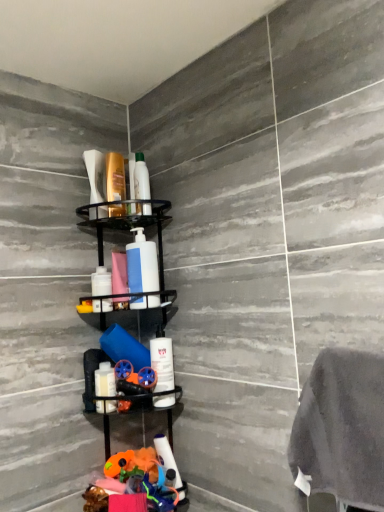
Measure the distance between translucent plastic shampoo bottle at upper center, which is the 5th toiletry in bottom-to-top order, and camera.

4.08 feet.

Identify the location of translucent plastic shampoo bottle at upper center, which is the 5th toiletry in bottom-to-top order. The width and height of the screenshot is (384, 512). (115, 177).

The width and height of the screenshot is (384, 512). Describe the element at coordinates (162, 362) in the screenshot. I see `white matte bottle at center, which is the fourth toiletry from top to bottom` at that location.

Where is `white matte bottle at center, which is the fourth toiletry from top to bottom`? white matte bottle at center, which is the fourth toiletry from top to bottom is located at coordinates (162, 362).

The width and height of the screenshot is (384, 512). Describe the element at coordinates (105, 380) in the screenshot. I see `white glossy bottle at lower left, the 1th toiletry positioned from the bottom` at that location.

Locate an element on the screen. The image size is (384, 512). white matte bottle at center, the 3th toiletry viewed from the top is located at coordinates click(x=101, y=282).

Considering the sizes of objects white matte bottle at center, which ranks as the 3th toiletry in bottom-to-top order, and white matte pump bottle at center in the image provided, who is smaller, white matte bottle at center, which ranks as the 3th toiletry in bottom-to-top order, or white matte pump bottle at center?

white matte bottle at center, which ranks as the 3th toiletry in bottom-to-top order, is smaller.

Is there a large distance between white matte bottle at center, the 3th toiletry viewed from the top, and white matte pump bottle at center?

Actually, white matte bottle at center, the 3th toiletry viewed from the top, and white matte pump bottle at center are a little close together.

Is the depth of white matte bottle at center, the 3th toiletry viewed from the top, less than that of white matte pump bottle at center?

No, it is not.

Looking at this image, is matte white soap dispenser at upper left, marked as the 2th toiletry in a top-to-bottom arrangement, inside black matte shelf at center?

Definitely not — matte white soap dispenser at upper left, marked as the 2th toiletry in a top-to-bottom arrangement, is not inside black matte shelf at center.

Between black matte shelf at center and matte white soap dispenser at upper left, marked as the 2th toiletry in a top-to-bottom arrangement, which one has larger size?

black matte shelf at center is bigger.

From a real-world perspective, is black matte shelf at center above or below matte white soap dispenser at upper left, positioned as the 4th toiletry in bottom-to-top order?

black matte shelf at center is below matte white soap dispenser at upper left, positioned as the 4th toiletry in bottom-to-top order.

Considering the positions of point (86, 381) and point (93, 172), is point (86, 381) closer or farther from the camera than point (93, 172)?

Point (86, 381) is positioned closer to the camera compared to point (93, 172).

Locate an element on the screen. This screenshot has height=512, width=384. the 1st toiletry below the matte white soap dispenser at upper left, marked as the 2th toiletry in a top-to-bottom arrangement (from the image's perspective) is located at coordinates (101, 282).

From the picture: Is white matte bottle at center, the 3th toiletry viewed from the top, positioned far away from matte white soap dispenser at upper left, positioned as the 4th toiletry in bottom-to-top order?

white matte bottle at center, the 3th toiletry viewed from the top, is near matte white soap dispenser at upper left, positioned as the 4th toiletry in bottom-to-top order, not far away.

Can you confirm if white matte bottle at center, the 3th toiletry viewed from the top, is positioned to the right of matte white soap dispenser at upper left, positioned as the 4th toiletry in bottom-to-top order?

Correct, you'll find white matte bottle at center, the 3th toiletry viewed from the top, to the right of matte white soap dispenser at upper left, positioned as the 4th toiletry in bottom-to-top order.

Is white matte bottle at center, the 3th toiletry viewed from the top, oriented away from matte white soap dispenser at upper left, positioned as the 4th toiletry in bottom-to-top order?

white matte bottle at center, the 3th toiletry viewed from the top, does not have its back to matte white soap dispenser at upper left, positioned as the 4th toiletry in bottom-to-top order.

In terms of height, does white matte bottle at center, the second toiletry from the bottom, look taller or shorter compared to white matte bottle at center, which ranks as the 3th toiletry in bottom-to-top order?

white matte bottle at center, the second toiletry from the bottom, is taller than white matte bottle at center, which ranks as the 3th toiletry in bottom-to-top order.

Can you tell me how much white matte bottle at center, the second toiletry from the bottom, and white matte bottle at center, which ranks as the 3th toiletry in bottom-to-top order, differ in facing direction?

There is a 0.0022-degree angle between the facing directions of white matte bottle at center, the second toiletry from the bottom, and white matte bottle at center, which ranks as the 3th toiletry in bottom-to-top order.

How much distance is there between white matte bottle at center, which is the fourth toiletry from top to bottom, and white matte bottle at center, the 3th toiletry viewed from the top?

A distance of 9.31 inches exists between white matte bottle at center, which is the fourth toiletry from top to bottom, and white matte bottle at center, the 3th toiletry viewed from the top.

Considering the sizes of objects white matte bottle at center, the second toiletry from the bottom, and white matte bottle at center, the 3th toiletry viewed from the top, in the image provided, who is wider, white matte bottle at center, the second toiletry from the bottom, or white matte bottle at center, the 3th toiletry viewed from the top,?

white matte bottle at center, the second toiletry from the bottom, is wider.

The height and width of the screenshot is (512, 384). Identify the location of shelf on the right of white matte bottle at center, the 3th toiletry viewed from the top. (128, 230).

From a real-world perspective, relative to black matte shelf at center, is white matte bottle at center, which ranks as the 3th toiletry in bottom-to-top order, vertically above or below?

white matte bottle at center, which ranks as the 3th toiletry in bottom-to-top order, is situated higher than black matte shelf at center in the real world.

Is white matte bottle at center, which ranks as the 3th toiletry in bottom-to-top order, far from black matte shelf at center?

No.

Is white matte bottle at center, which ranks as the 3th toiletry in bottom-to-top order, wider or thinner than black matte shelf at center?

In the image, white matte bottle at center, which ranks as the 3th toiletry in bottom-to-top order, appears to be more narrow than black matte shelf at center.

Is black matte shelf at center positioned with its back to translucent plastic shampoo bottle at upper center, which is the 1th toiletry in top-to-bottom order?

black matte shelf at center does not have its back to translucent plastic shampoo bottle at upper center, which is the 1th toiletry in top-to-bottom order.

Consider the image. Choose the correct answer: Is black matte shelf at center inside translucent plastic shampoo bottle at upper center, which is the 5th toiletry in bottom-to-top order, or outside it?

black matte shelf at center is not enclosed by translucent plastic shampoo bottle at upper center, which is the 5th toiletry in bottom-to-top order.

Is black matte shelf at center with translucent plastic shampoo bottle at upper center, which is the 5th toiletry in bottom-to-top order?

black matte shelf at center and translucent plastic shampoo bottle at upper center, which is the 5th toiletry in bottom-to-top order, are clearly separated.

Looking at their sizes, would you say white matte pump bottle at center is wider or thinner than white glossy bottle at lower left, the 1th toiletry positioned from the bottom?

Considering their sizes, white matte pump bottle at center looks slimmer than white glossy bottle at lower left, the 1th toiletry positioned from the bottom.

Between white matte pump bottle at center and white glossy bottle at lower left, marked as the 5th toiletry in a top-to-bottom arrangement, which one appears on the right side from the viewer's perspective?

Positioned to the right is white matte pump bottle at center.

Does white matte pump bottle at center have a lesser height compared to white glossy bottle at lower left, the 1th toiletry positioned from the bottom?

Incorrect, the height of white matte pump bottle at center does not fall short of that of white glossy bottle at lower left, the 1th toiletry positioned from the bottom.

Would you consider white matte pump bottle at center to be distant from white glossy bottle at lower left, marked as the 5th toiletry in a top-to-bottom arrangement?

No, white matte pump bottle at center is not far away from white glossy bottle at lower left, marked as the 5th toiletry in a top-to-bottom arrangement.

Find the location of a particular element. Image resolution: width=384 pixels, height=512 pixels. the 3rd toiletry to the left of the white matte pump bottle at center, starting your count from the anchor is located at coordinates (101, 282).

Locate an element on the screen. shelf located underneath the matte white soap dispenser at upper left, positioned as the 4th toiletry in bottom-to-top order (from a real-world perspective) is located at coordinates (128, 230).

From the image, which object appears to be farther from white matte bottle at center, the 3th toiletry viewed from the top, white matte bottle at center, which is the fourth toiletry from top to bottom, or matte white soap dispenser at upper left, positioned as the 4th toiletry in bottom-to-top order?

Based on the image, matte white soap dispenser at upper left, positioned as the 4th toiletry in bottom-to-top order, appears to be further to white matte bottle at center, the 3th toiletry viewed from the top.

Based on their spatial positions, is white matte bottle at center, the second toiletry from the bottom, or white matte pump bottle at center closer to translucent plastic shampoo bottle at upper center, which is the 5th toiletry in bottom-to-top order?

Based on the image, white matte pump bottle at center appears to be nearer to translucent plastic shampoo bottle at upper center, which is the 5th toiletry in bottom-to-top order.

Considering their positions, is white glossy bottle at lower left, marked as the 5th toiletry in a top-to-bottom arrangement, positioned further to matte white soap dispenser at upper left, marked as the 2th toiletry in a top-to-bottom arrangement, than translucent plastic shampoo bottle at upper center, which is the 5th toiletry in bottom-to-top order?

Based on the image, white glossy bottle at lower left, marked as the 5th toiletry in a top-to-bottom arrangement, appears to be further to matte white soap dispenser at upper left, marked as the 2th toiletry in a top-to-bottom arrangement.

Based on their spatial positions, is matte white soap dispenser at upper left, positioned as the 4th toiletry in bottom-to-top order, or white matte bottle at center, which is the fourth toiletry from top to bottom, closer to black matte shelf at center?

matte white soap dispenser at upper left, positioned as the 4th toiletry in bottom-to-top order, is closer to black matte shelf at center.

Looking at the image, which one is located closer to matte white soap dispenser at upper left, positioned as the 4th toiletry in bottom-to-top order, white matte bottle at center, the second toiletry from the bottom, or white matte pump bottle at center?

white matte pump bottle at center is closer to matte white soap dispenser at upper left, positioned as the 4th toiletry in bottom-to-top order.

From the picture: Based on their spatial positions, is white matte bottle at center, the second toiletry from the bottom, or black matte shelf at center further from white matte pump bottle at center?

white matte bottle at center, the second toiletry from the bottom, is positioned further to the anchor white matte pump bottle at center.

When comparing their distances from white matte pump bottle at center, does white matte bottle at center, which is the fourth toiletry from top to bottom, or translucent plastic shampoo bottle at upper center, which is the 5th toiletry in bottom-to-top order, seem further?

The object further to white matte pump bottle at center is white matte bottle at center, which is the fourth toiletry from top to bottom.

Based on their spatial positions, is white matte bottle at center, the 3th toiletry viewed from the top, or white glossy bottle at lower left, marked as the 5th toiletry in a top-to-bottom arrangement, further from translucent plastic shampoo bottle at upper center, which is the 5th toiletry in bottom-to-top order?

Based on the image, white glossy bottle at lower left, marked as the 5th toiletry in a top-to-bottom arrangement, appears to be further to translucent plastic shampoo bottle at upper center, which is the 5th toiletry in bottom-to-top order.

Where is `toiletry between translucent plastic shampoo bottle at upper center, which is the 1th toiletry in top-to-bottom order, and white matte pump bottle at center, in the vertical direction`? toiletry between translucent plastic shampoo bottle at upper center, which is the 1th toiletry in top-to-bottom order, and white matte pump bottle at center, in the vertical direction is located at coordinates (96, 174).

Where is `shelf located between white glossy bottle at lower left, the 1th toiletry positioned from the bottom, and white matte bottle at center, the second toiletry from the bottom, in the left-right direction`? This screenshot has width=384, height=512. shelf located between white glossy bottle at lower left, the 1th toiletry positioned from the bottom, and white matte bottle at center, the second toiletry from the bottom, in the left-right direction is located at coordinates (128, 230).

Locate an element on the screen. This screenshot has width=384, height=512. toiletry that lies between matte white soap dispenser at upper left, marked as the 2th toiletry in a top-to-bottom arrangement, and black matte shelf at center from top to bottom is located at coordinates (101, 282).

Image resolution: width=384 pixels, height=512 pixels. Find the location of `shelf that lies between white matte bottle at center, which ranks as the 3th toiletry in bottom-to-top order, and white matte bottle at center, which is the fourth toiletry from top to bottom, from top to bottom`. shelf that lies between white matte bottle at center, which ranks as the 3th toiletry in bottom-to-top order, and white matte bottle at center, which is the fourth toiletry from top to bottom, from top to bottom is located at coordinates pyautogui.click(x=128, y=230).